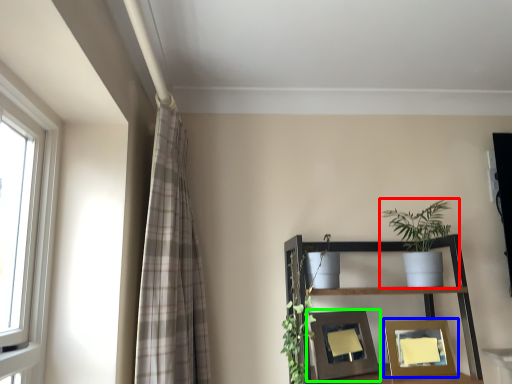
Question: Which object is the farthest from houseplant (highlighted by a red box)? Choose among these: picture frame (highlighted by a blue box) or picture frame (highlighted by a green box).

Choices:
 (A) picture frame
 (B) picture frame

Answer: (B)